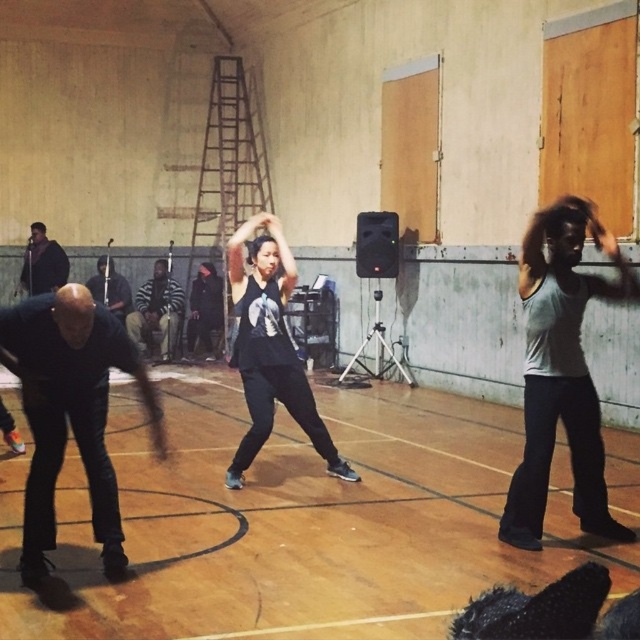
Question: Can you confirm if gray matte tank top at right is thinner than dark brown leather jacket at left?

Choices:
 (A) no
 (B) yes

Answer: (B)

Question: Which object is closer to the camera taking this photo?

Choices:
 (A) dark gray hoodie at center
 (B) wooden floor at center

Answer: (B)

Question: Which object is the closest to the black matte pants at left?

Choices:
 (A) dark gray hoodie at center
 (B) dark brown leather jacket at left
 (C) striped fabric shirt at center
 (D) black matte tank top at center

Answer: (D)

Question: Can you confirm if gray matte tank top at right is positioned below black matte pants at left?

Choices:
 (A) yes
 (B) no

Answer: (B)

Question: In this image, where is striped fabric shirt at center located relative to dark brown leather jacket at left?

Choices:
 (A) right
 (B) left

Answer: (A)

Question: Which point is closer to the camera?

Choices:
 (A) (166, 282)
 (B) (531, 410)

Answer: (B)